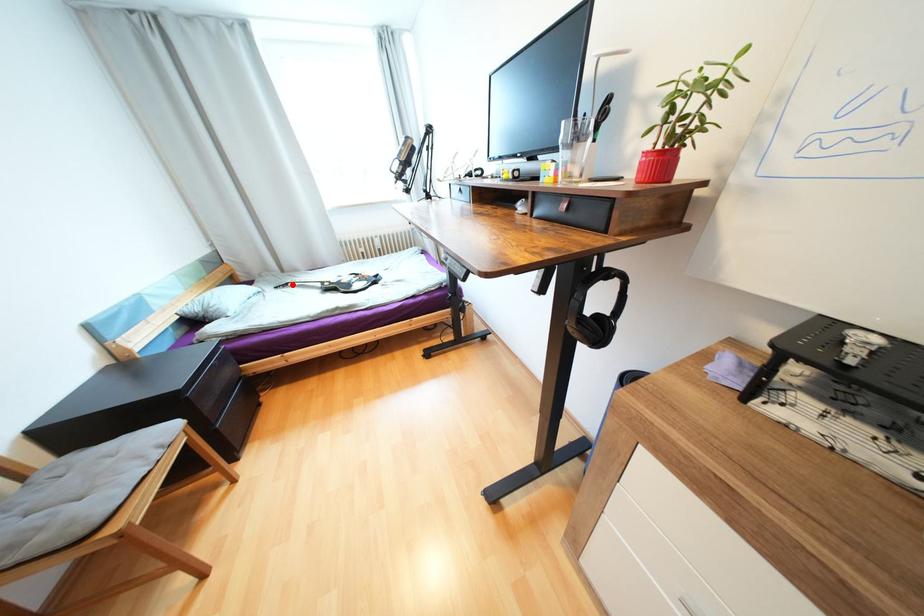
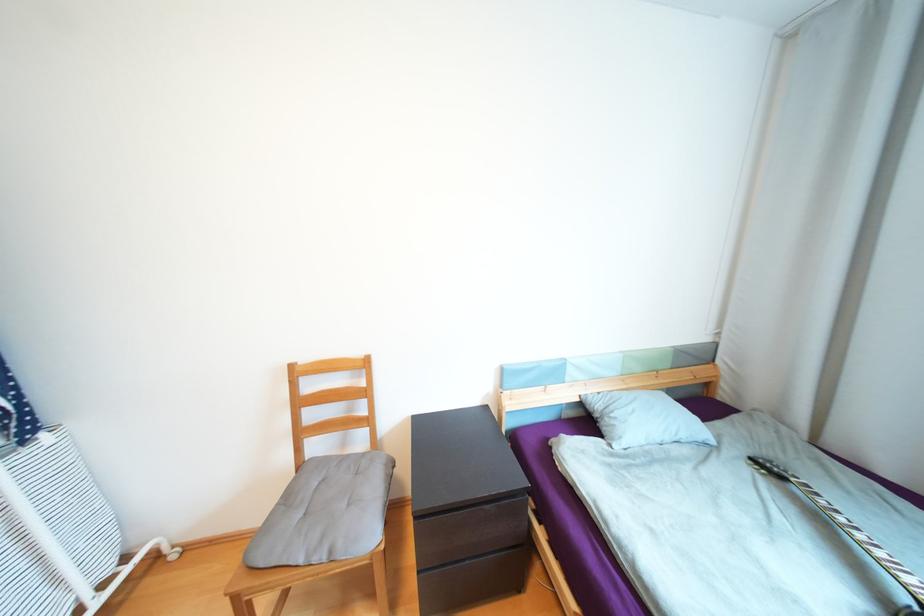
Question: I am providing you with two images of the same scene from different viewpoints. A red point is shown in image1. For the corresponding object point in image2, is it positioned nearer or farther from the camera?

Choices:
 (A) Nearer
 (B) Farther

Answer: (B)